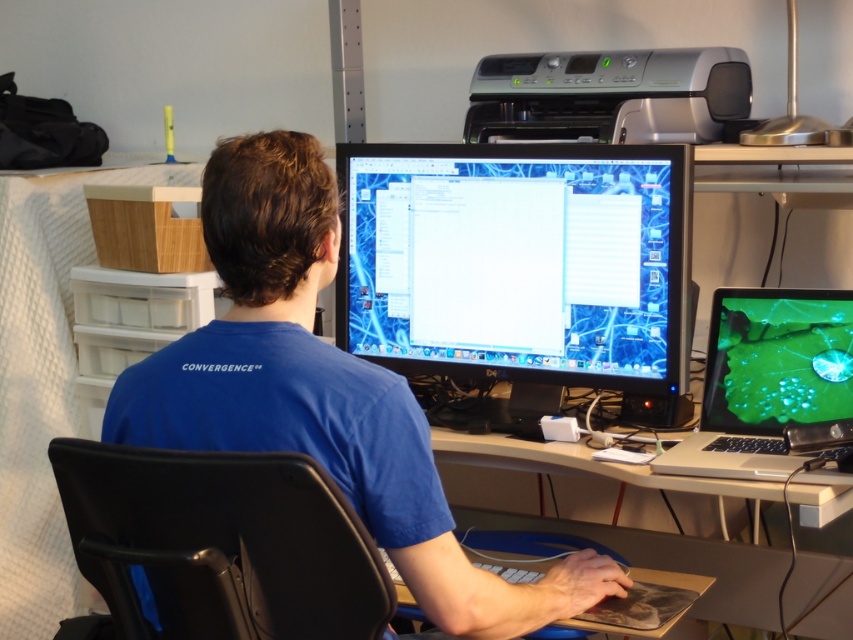
You are taking a photo of the workspace from the front. There are two points marked on the desk surface at coordinates point (569, 177) and point (544, 65). Which point will appear larger in your photo?

Point (569, 177) is closer to the camera than point (544, 65), so it will appear larger in the photo.

You are organizing the desk and need to place a new item between the smooth wooden table at center and the shiny silver laptop at lower right. Based on their positions, where should you place the item?

The smooth wooden table at center is to the left of the shiny silver laptop at lower right, so you should place the new item between them on the desk, to the right of the table and left of the laptop.